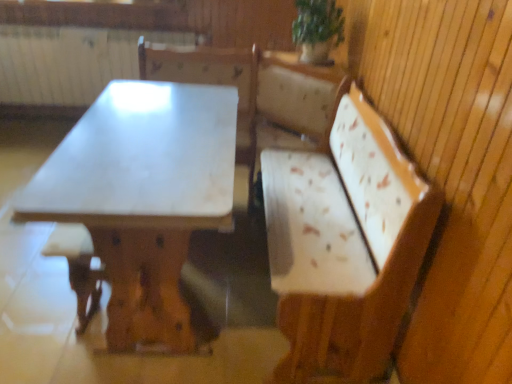
Question: Is brown wood step stool at lower left positioned before white marble table at center?

Choices:
 (A) yes
 (B) no

Answer: (B)

Question: From a real-world perspective, does brown wood step stool at lower left sit lower than white marble table at center?

Choices:
 (A) yes
 (B) no

Answer: (A)

Question: From a real-world perspective, is brown wood step stool at lower left over white marble table at center?

Choices:
 (A) yes
 (B) no

Answer: (B)

Question: Can you confirm if brown wood step stool at lower left is thinner than white marble table at center?

Choices:
 (A) no
 (B) yes

Answer: (B)

Question: Does brown wood step stool at lower left come behind white marble table at center?

Choices:
 (A) no
 (B) yes

Answer: (B)

Question: Is white marble table at center to the left or to the right of white painted radiator at upper left in the image?

Choices:
 (A) left
 (B) right

Answer: (B)

Question: Considering the positions of point (225, 165) and point (84, 92), is point (225, 165) closer or farther from the camera than point (84, 92)?

Choices:
 (A) closer
 (B) farther

Answer: (A)

Question: From the image's perspective, relative to white painted radiator at upper left, is white marble table at center above or below?

Choices:
 (A) above
 (B) below

Answer: (B)

Question: From a real-world perspective, is white marble table at center physically located above or below white painted radiator at upper left?

Choices:
 (A) above
 (B) below

Answer: (B)

Question: In terms of size, does white painted radiator at upper left appear bigger or smaller than brown wood step stool at lower left?

Choices:
 (A) small
 (B) big

Answer: (B)

Question: Which is correct: white painted radiator at upper left is inside brown wood step stool at lower left, or outside of it?

Choices:
 (A) inside
 (B) outside

Answer: (B)

Question: From their relative heights in the image, would you say white painted radiator at upper left is taller or shorter than brown wood step stool at lower left?

Choices:
 (A) short
 (B) tall

Answer: (B)

Question: From a real-world perspective, is white painted radiator at upper left physically located above or below brown wood step stool at lower left?

Choices:
 (A) above
 (B) below

Answer: (A)

Question: Is brown wood step stool at lower left spatially inside white marble table at center, or outside of it?

Choices:
 (A) outside
 (B) inside

Answer: (B)

Question: In the image, is brown wood step stool at lower left positioned in front of or behind white marble table at center?

Choices:
 (A) front
 (B) behind

Answer: (B)